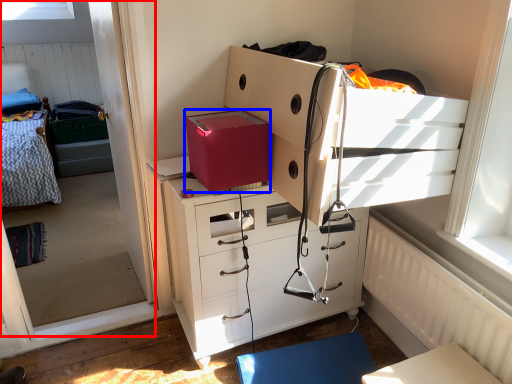
Question: Which object appears farthest to the camera in this image, window screen (highlighted by a red box) or shoe box (highlighted by a blue box)?

Choices:
 (A) window screen
 (B) shoe box

Answer: (B)